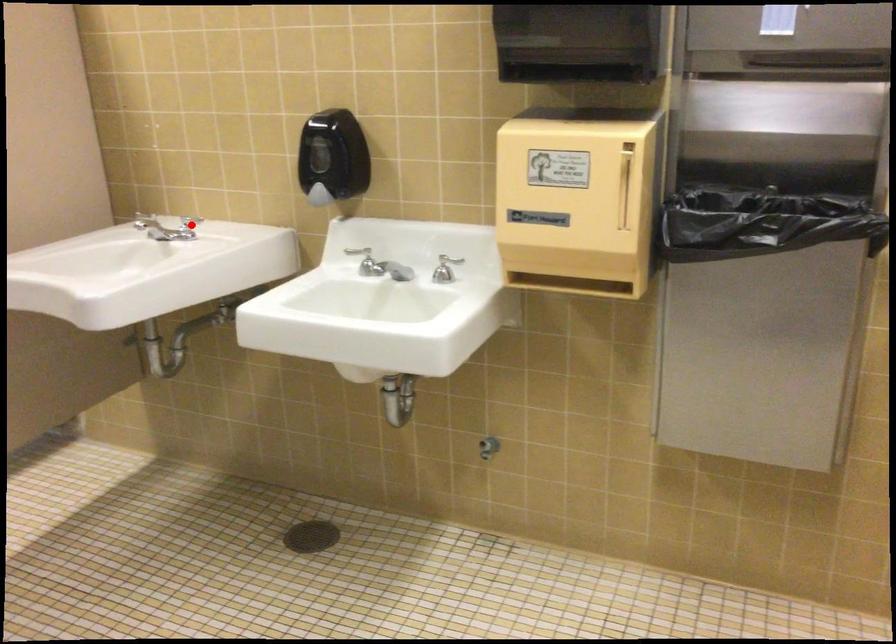
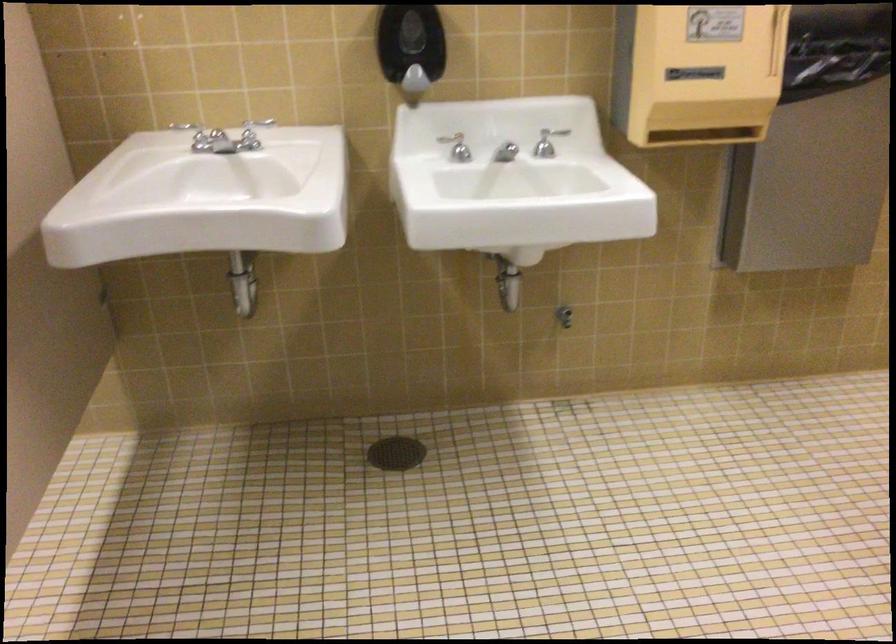
Where in the second image is the point corresponding to the highlighted location from the first image?

(194, 135)